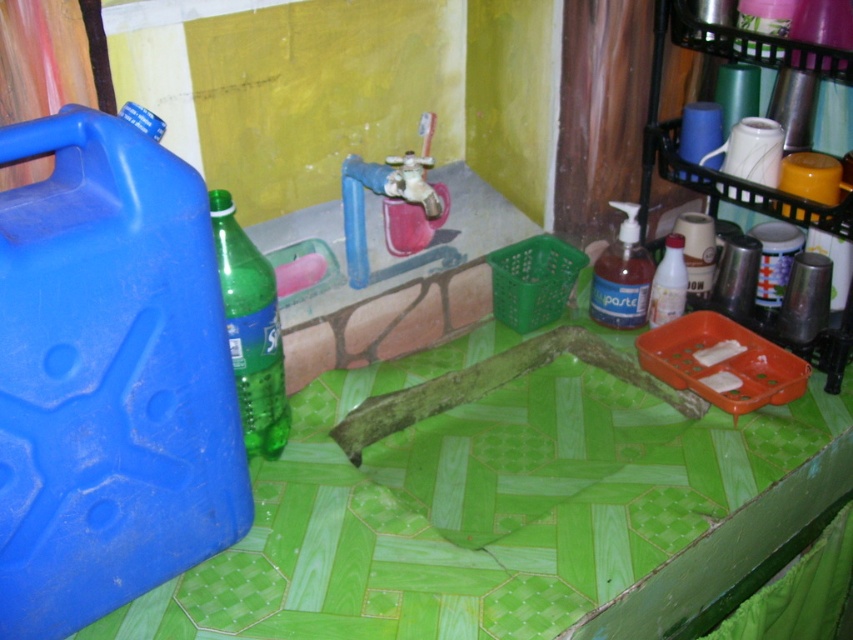
Question: Does green wood table at center have a smaller size compared to green matte bottle at center?

Choices:
 (A) yes
 (B) no

Answer: (B)

Question: Is green wood table at center to the right of translucent plastic soap dispenser at center-right from the viewer's perspective?

Choices:
 (A) no
 (B) yes

Answer: (A)

Question: Estimate the real-world distances between objects in this image. Which object is farther from the green wood table at center?

Choices:
 (A) translucent plastic bottle at center
 (B) translucent plastic soap dispenser at center-right

Answer: (A)

Question: Is green matte bottle at center wider than translucent plastic soap dispenser at center-right?

Choices:
 (A) no
 (B) yes

Answer: (A)

Question: Which point is closer to the camera?

Choices:
 (A) translucent plastic bottle at center
 (B) translucent plastic soap dispenser at center-right

Answer: (A)

Question: Which point appears closest to the camera in this image?

Choices:
 (A) (273, 356)
 (B) (630, 317)
 (C) (608, 392)

Answer: (A)